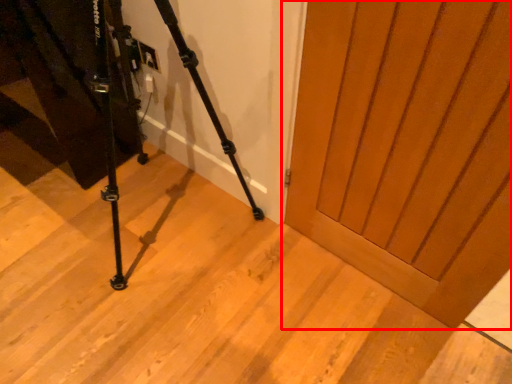
Question: From the image's perspective, where is door (annotated by the red box) located relative to tripod?

Choices:
 (A) above
 (B) below

Answer: (B)